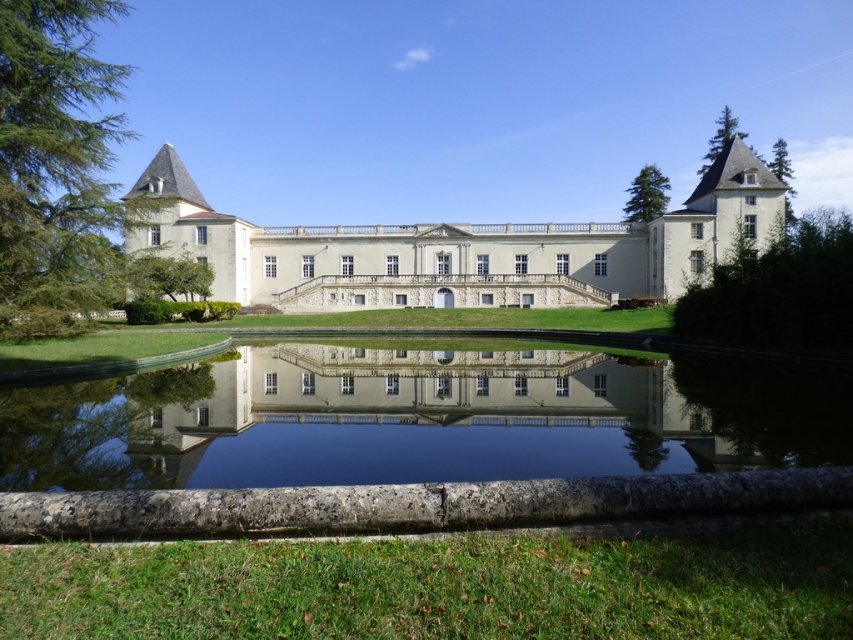
You are standing in front of the chateau and notice two green trees in the scene. Which tree, the green leafy tree at right or the green textured tree at upper right, is positioned lower in the image?

The green leafy tree at right is positioned lower in the image because it is below the green textured tree at upper right.

You are standing in front of the chateau and want to take a photo that includes both the white smooth palace at center and the green leafy tree at right. Based on their positions, which object should you place on the left side of your photo frame?

The white smooth palace at center should be placed on the left side of your photo frame because it is positioned on the left side of the green leafy tree at right.

You are an architect analyzing the symmetry of the chateau. Given that the white smooth palace at center and the green leafy tree at left are part of the design, which one is taller?

The white smooth palace at center is taller than the green leafy tree at left according to the description.